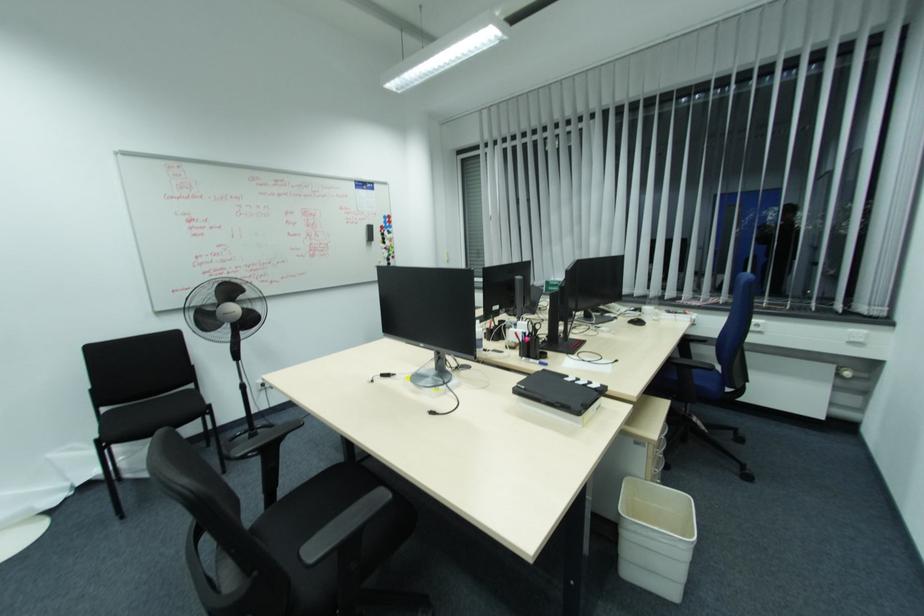
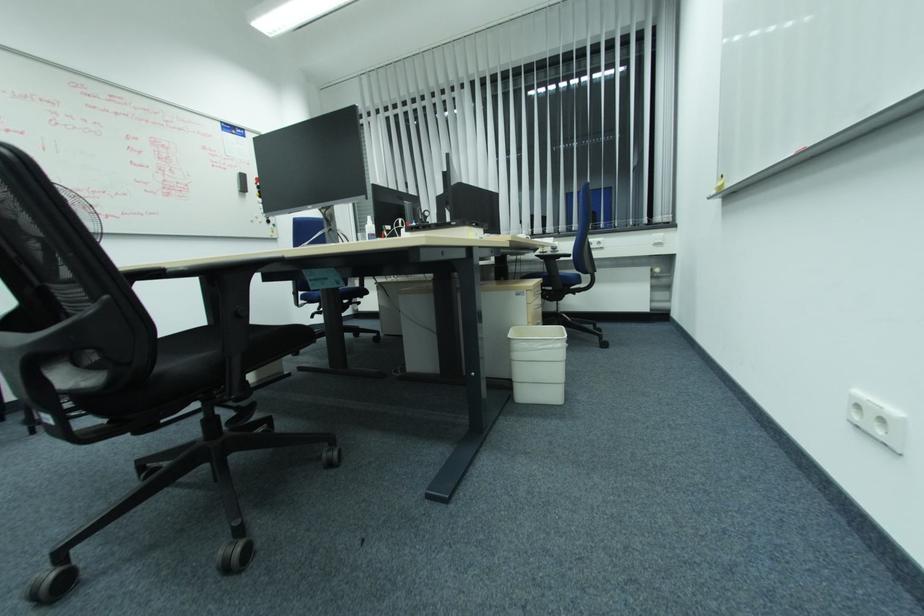
Question: What movement of the cameraman would produce the second image?

Choices:
 (A) Left
 (B) Right
 (C) Forward
 (D) Backward

Answer: (D)